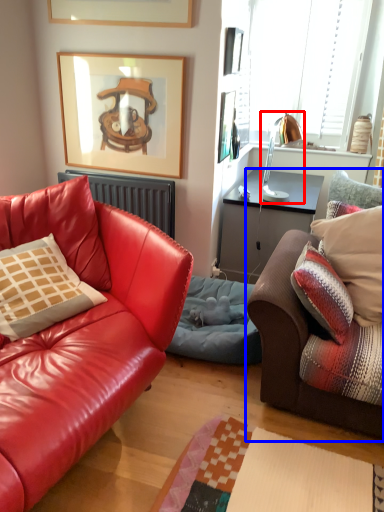
Question: Which point is further to the camera, lamp (highlighted by a red box) or studio couch (highlighted by a blue box)?

Choices:
 (A) lamp
 (B) studio couch

Answer: (A)